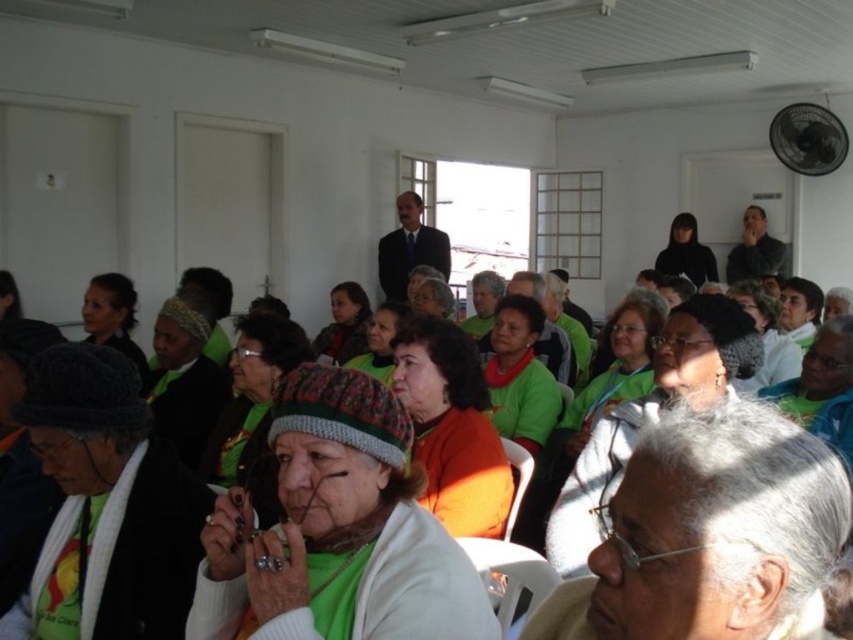
You are organizing a charity event and need to decide which item to place on a shelf that can only hold items shorter than 10 inches. You have the green knitted hat at center and the green fabric at center. Based on their heights, which item can be safely placed on the shelf?

The green knitted hat at center is not as tall as the green fabric at center, so the green knitted hat at center can be safely placed on the shelf since it is shorter than the green fabric at center. However, without knowing the exact height of the fabric, we cannot confirm if it meets the 10 inch requirement. Please check the fabric height first.

You are organizing a charity event and need to place a small donation box between the green knitted hat at center and the dark suit at center. Which object should you place the box closer to if the box requires more space on the side facing the thinner object?

The donation box should be placed closer to the green knitted hat at center because it is thinner than the dark suit at center, allowing more space on the side facing the hat.